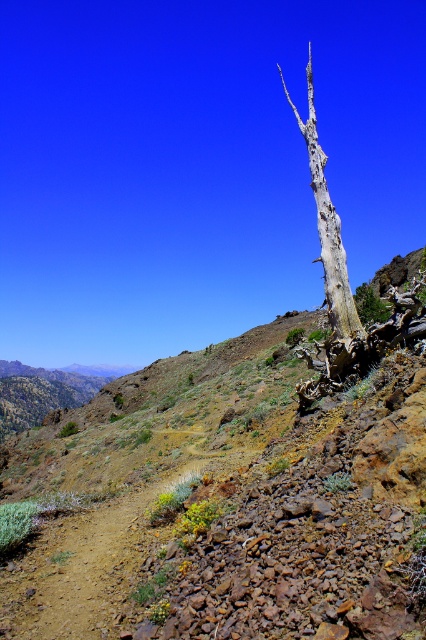
You are standing at the base of the weathered tree trunk in the arid landscape. You notice two points marked in the scene. Which point, point (x=322, y=193) or point (x=362, y=308), is closer to you?

Point (x=322, y=193) is closer to the viewer than point (x=362, y=308).